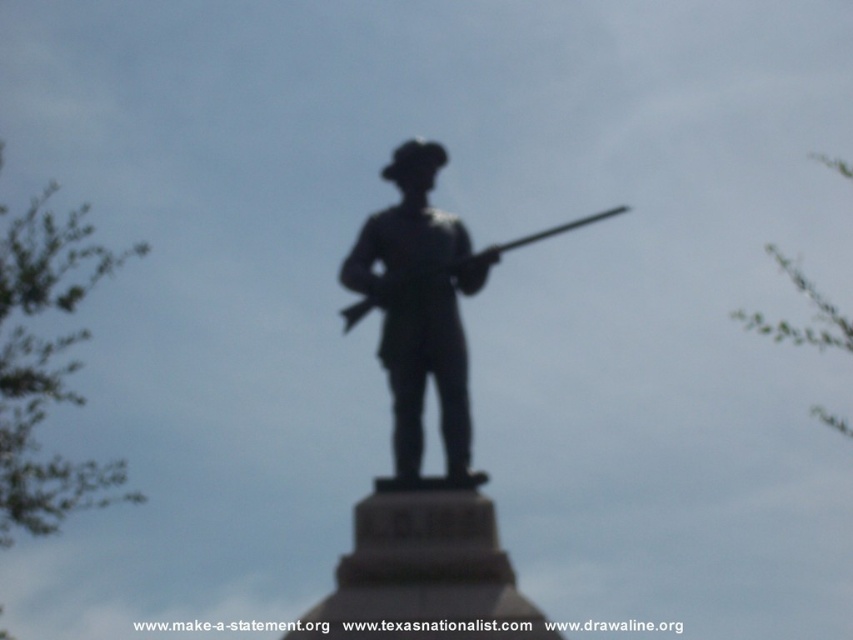
Question: Which point is closer to the camera taking this photo?

Choices:
 (A) (421, 445)
 (B) (577, 224)
 (C) (434, 321)

Answer: (A)

Question: Does black metal statue at center appear over silhouette wood figure at center?

Choices:
 (A) yes
 (B) no

Answer: (B)

Question: Where is black metal statue at center located in relation to silhouette wood figure at center in the image?

Choices:
 (A) left
 (B) right

Answer: (B)

Question: Is black metal statue at center below metallic rifle at center?

Choices:
 (A) no
 (B) yes

Answer: (B)

Question: Considering the real-world distances, which object is closest to the black metal statue at center?

Choices:
 (A) metallic rifle at center
 (B) silhouette wood figure at center

Answer: (B)

Question: Which object is the closest to the black metal statue at center?

Choices:
 (A) silhouette wood figure at center
 (B) metallic rifle at center

Answer: (A)